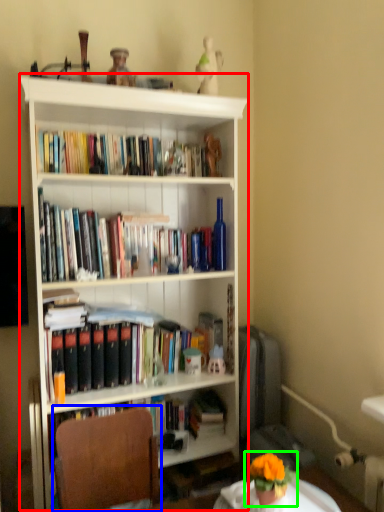
Question: Which object is the farthest from bookcase (highlighted by a red box)? Choose among these: chair (highlighted by a blue box) or houseplant (highlighted by a green box).

Choices:
 (A) chair
 (B) houseplant

Answer: (B)